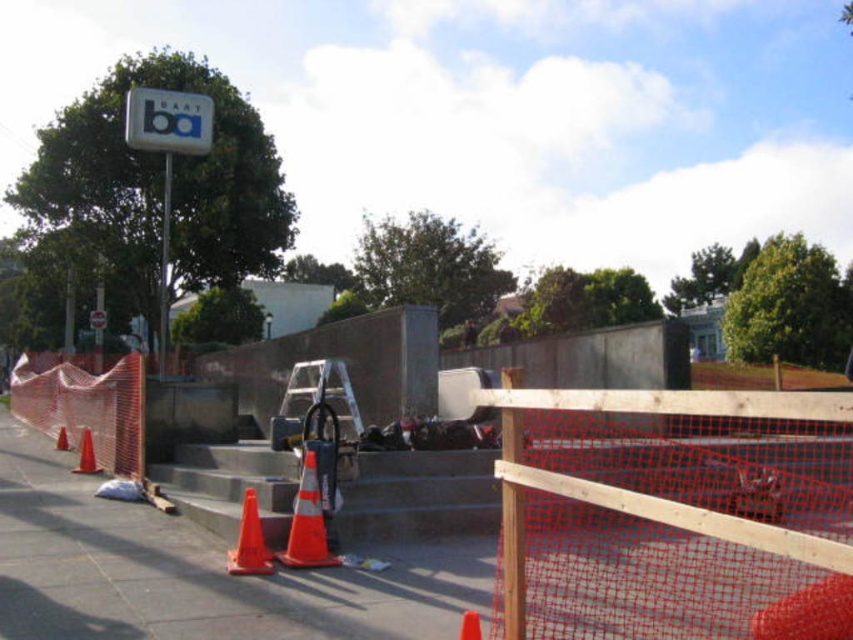
Based on the photo, you are a pedestrian walking along the sidewalk and see the wooden mesh fence at center and the white plastic sign at upper center. Which object is closer to you as you face the scene?

The wooden mesh fence at center is closer to you because it is in front of the white plastic sign at upper center.

You are a delivery person who needs to place a 3.5 meter long package between the white plastic sign at upper left and the white plastic sign at upper center. Can you fit it between them without bending the package?

The distance between the white plastic sign at upper left and the white plastic sign at upper center is 3.51 meters, so yes, the package can fit between them without bending since it is slightly shorter than the distance.